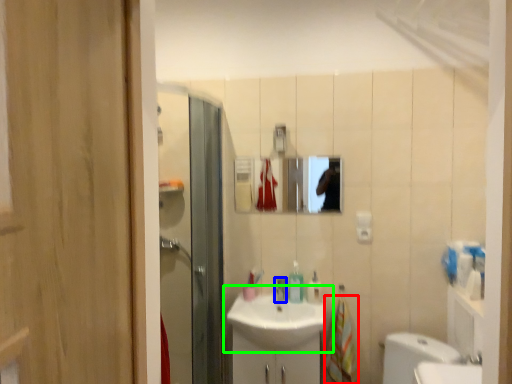
Question: Considering the real-world distances, which object is closest to hand towel (highlighted by a red box)? tap (highlighted by a blue box) or sink (highlighted by a green box).

Choices:
 (A) tap
 (B) sink

Answer: (B)